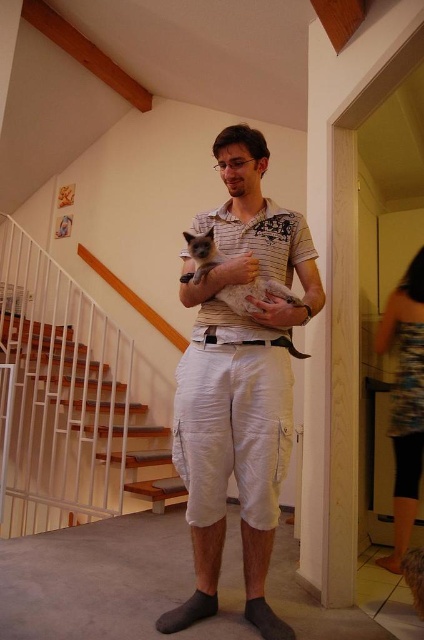
You are standing in the hallway and want to reach the point at coordinates [44,420]. If your maximum reach is 10 feet, can you reach it?

The point at coordinates [44,420] is 11.39 feet away from the camera, which exceeds your maximum reach of 10 feet. Therefore, you cannot reach it.

You are a fashion designer looking at this image and want to suggest a matching top for the white cotton pants at center. Based on the scene description, what color and style of top would you recommend?

The man in the scene is wearing a striped polo shirt, so a similar striped pattern in a complementary color would match well with the white cotton pants at center.